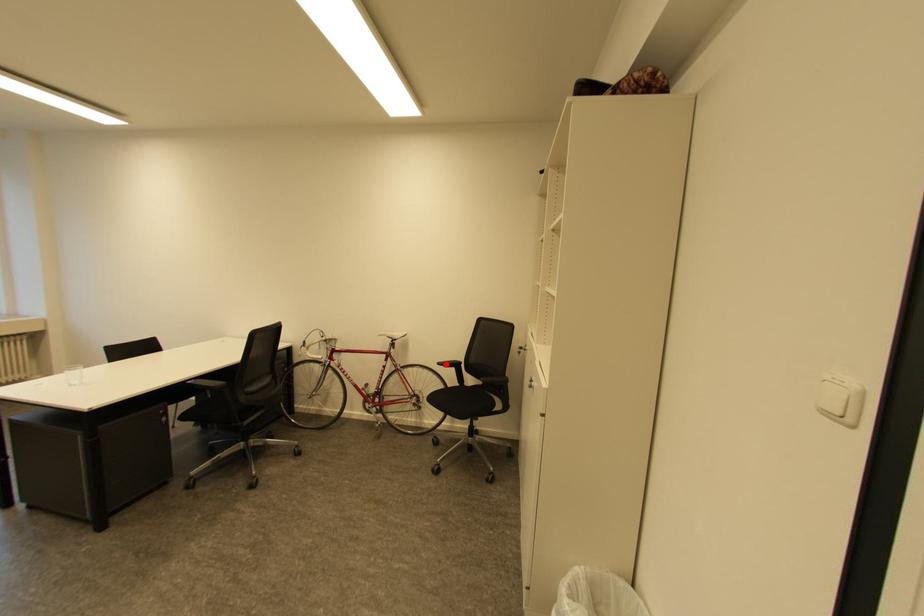
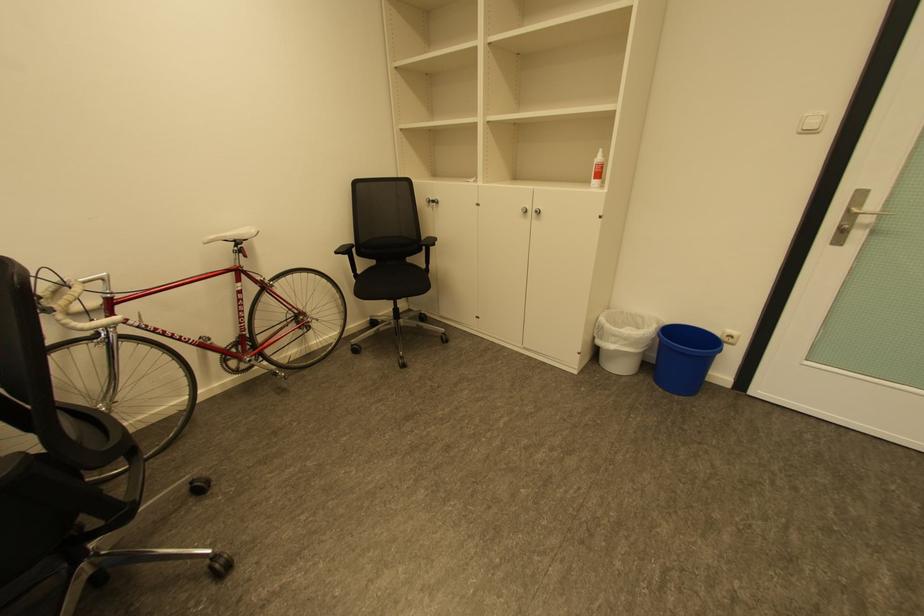
The point at the highlighted location is marked in the first image. Where is the corresponding point in the second image?

(344, 253)